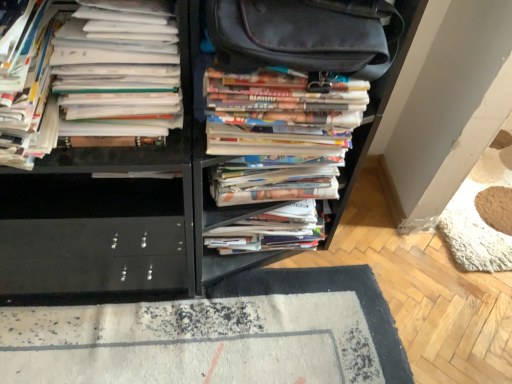
Question: Does white paper stack at left, which is the third book in right-to-left order, lie behind white paper stack at center, which appears as the third book when viewed from the left?

Choices:
 (A) no
 (B) yes

Answer: (A)

Question: Considering the relative positions of white paper stack at left, arranged as the second book when viewed from the left, and white paper stack at center, the 2th book from the right, in the image provided, is white paper stack at left, arranged as the second book when viewed from the left, to the right of white paper stack at center, the 2th book from the right, from the viewer's perspective?

Choices:
 (A) yes
 (B) no

Answer: (B)

Question: Is white paper stack at left, arranged as the second book when viewed from the left, to the left of white paper stack at center, the 2th book from the right, from the viewer's perspective?

Choices:
 (A) no
 (B) yes

Answer: (B)

Question: Is the surface of white paper stack at left, arranged as the second book when viewed from the left, in direct contact with white paper stack at center, which appears as the third book when viewed from the left?

Choices:
 (A) yes
 (B) no

Answer: (B)

Question: Is white paper stack at center, the 2th book from the right, completely or partially inside white paper stack at left, which is the third book in right-to-left order?

Choices:
 (A) no
 (B) yes

Answer: (A)

Question: Relative to multicolored paper stack at center, placed as the 1th book when sorted from right to left, is white paper stack at center, which appears as the third book when viewed from the left, in front or behind?

Choices:
 (A) behind
 (B) front

Answer: (A)

Question: Is point (224, 230) closer or farther from the camera than point (224, 97)?

Choices:
 (A) farther
 (B) closer

Answer: (A)

Question: Is white paper stack at center, which appears as the third book when viewed from the left, spatially inside multicolored paper stack at center, acting as the fourth book starting from the left, or outside of it?

Choices:
 (A) outside
 (B) inside

Answer: (A)

Question: From the image's perspective, relative to multicolored paper stack at center, acting as the fourth book starting from the left, is white paper stack at center, which appears as the third book when viewed from the left, above or below?

Choices:
 (A) above
 (B) below

Answer: (B)

Question: Is point (27, 167) closer or farther from the camera than point (76, 134)?

Choices:
 (A) closer
 (B) farther

Answer: (A)

Question: Is white paper stack at left, which is the first book in left-to-right order, in front of or behind white paper stack at left, arranged as the second book when viewed from the left, in the image?

Choices:
 (A) behind
 (B) front

Answer: (B)

Question: Is white paper stack at left, which is the first book in left-to-right order, wider or thinner than white paper stack at left, arranged as the second book when viewed from the left?

Choices:
 (A) wide
 (B) thin

Answer: (A)

Question: Considering the relative positions of white paper stack at left, which is the 4th book from right to left, and white paper stack at left, arranged as the second book when viewed from the left, in the image provided, is white paper stack at left, which is the 4th book from right to left, to the left or to the right of white paper stack at left, arranged as the second book when viewed from the left,?

Choices:
 (A) left
 (B) right

Answer: (A)

Question: Considering the positions of multicolored paper stack at center, placed as the 1th book when sorted from right to left, and white paper stack at left, arranged as the second book when viewed from the left, in the image, is multicolored paper stack at center, placed as the 1th book when sorted from right to left, wider or thinner than white paper stack at left, arranged as the second book when viewed from the left,?

Choices:
 (A) wide
 (B) thin

Answer: (B)

Question: From the image's perspective, is multicolored paper stack at center, placed as the 1th book when sorted from right to left, positioned above or below white paper stack at left, which is the third book in right-to-left order?

Choices:
 (A) below
 (B) above

Answer: (A)